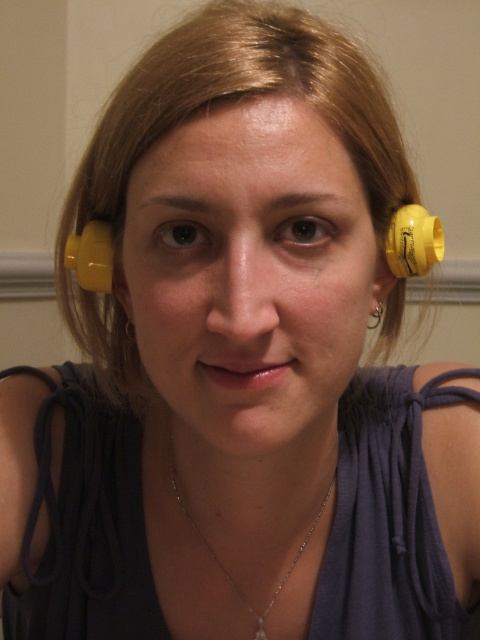
You are standing in front of the person in the image. You notice two points marked on their head. One is at coordinate point (x=379, y=285) and the other at point (x=118, y=310). Which point is closer to your eyes?

Point (x=379, y=285) is closer to the viewer than point (x=118, y=310).

Based on the scene description, where is the silver chain necklace at center located in terms of its position relative to the baseboard heater or trim on the wall?

The silver chain necklace at center is located above the baseboard heater or trim on the wall since its 2D coordinates are at point (x=222, y=563). The y coordinate of 0.463 indicates it is positioned higher up on the person, placing it above the baseboard heater which is on the lower part of the wall.